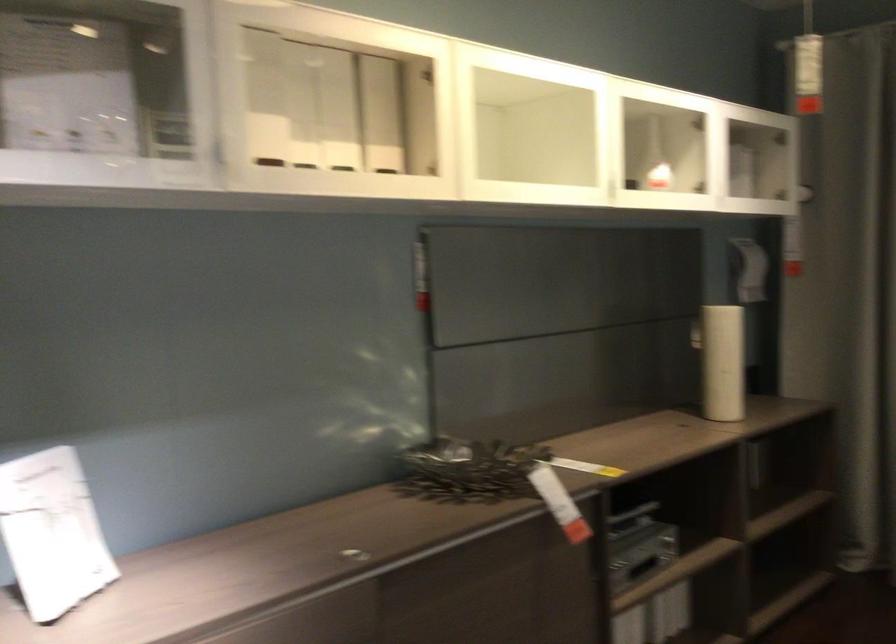
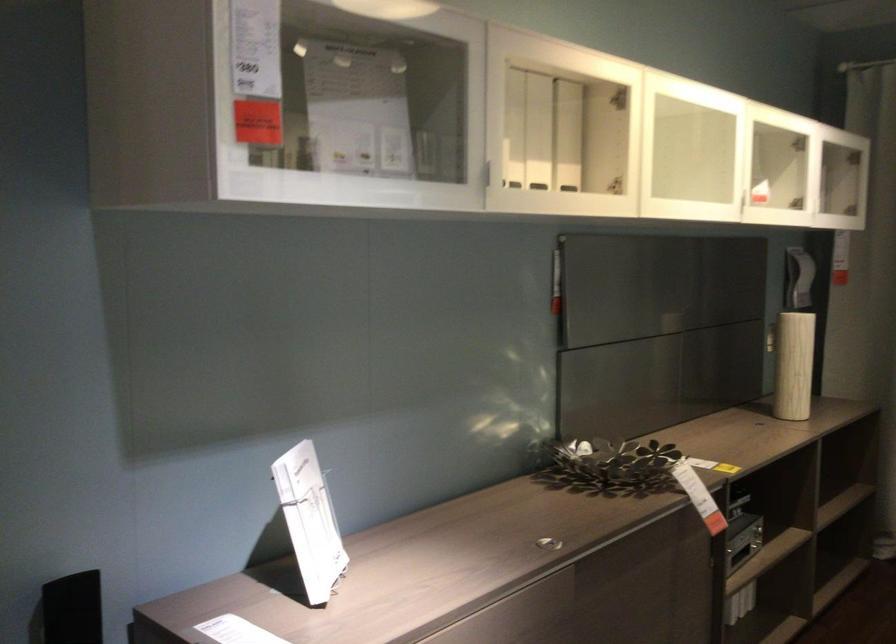
Find the pixel in the second image that matches the point at 340,111 in the first image.

(538, 131)